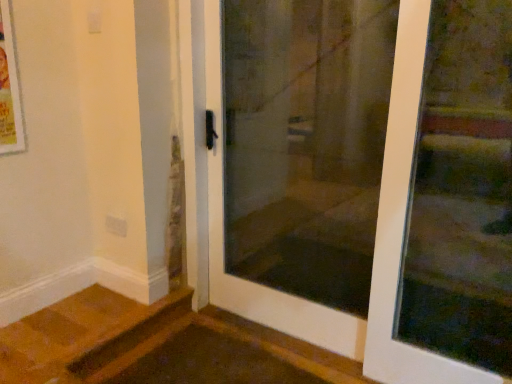
Question: Would you say transparent glass screen door at center is to the left or to the right of transparent glass door at upper right, which is the second door from left to right, in the picture?

Choices:
 (A) right
 (B) left

Answer: (B)

Question: Considering the positions of transparent glass screen door at center and transparent glass door at upper right, which is the second door from left to right, in the image, is transparent glass screen door at center taller or shorter than transparent glass door at upper right, which is the second door from left to right,?

Choices:
 (A) tall
 (B) short

Answer: (A)

Question: Considering the real-world distances, which object is closest to the transparent glass screen door at center?

Choices:
 (A) white glass door at center, which ranks as the first door in left-to-right order
 (B) transparent glass door at upper right, placed as the first door when sorted from right to left

Answer: (A)

Question: Which of these objects is positioned closest to the transparent glass door at upper right, placed as the first door when sorted from right to left?

Choices:
 (A) transparent glass screen door at center
 (B) white glass door at center, which ranks as the first door in left-to-right order

Answer: (B)